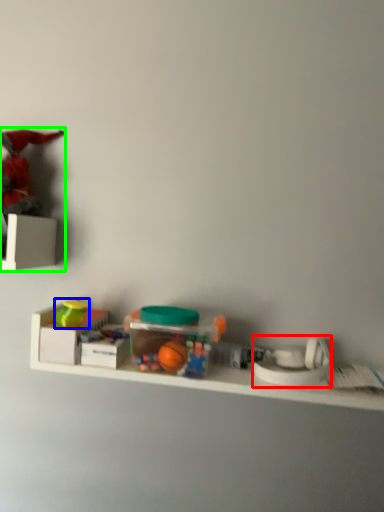
Question: Which object is the closest to the toy (highlighted by a red box)? Choose among these: toy (highlighted by a blue box) or toy (highlighted by a green box).

Choices:
 (A) toy
 (B) toy

Answer: (A)